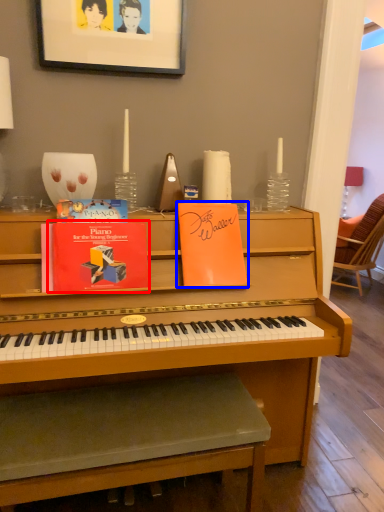
Question: Which point is closer to the camera, paperback book (highlighted by a red box) or paperback book (highlighted by a blue box)?

Choices:
 (A) paperback book
 (B) paperback book

Answer: (A)